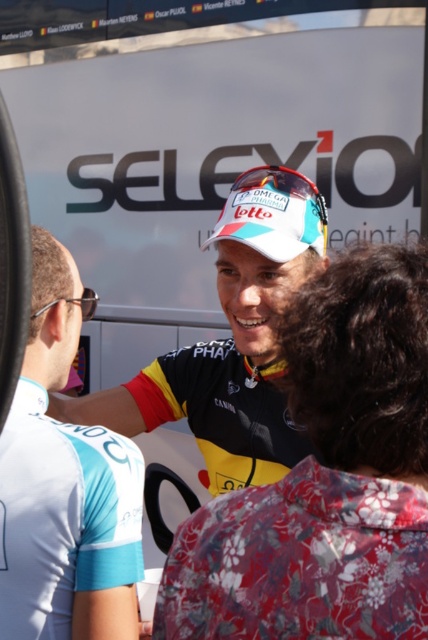
Looking at this image, can you confirm if teal jersey at center is positioned below clear plastic glasses at left?

Yes.

Image resolution: width=428 pixels, height=640 pixels. I want to click on teal jersey at center, so click(64, 488).

Which is above, black jersey at center or yellow and black jersey at center?

yellow and black jersey at center

Does black jersey at center have a larger size compared to yellow and black jersey at center?

No.

Find the location of `black jersey at center`. black jersey at center is located at coordinates (326, 477).

What do you see at coordinates (231, 340) in the screenshot? This screenshot has height=640, width=428. I see `yellow and black jersey at center` at bounding box center [231, 340].

This screenshot has height=640, width=428. Find the location of `yellow and black jersey at center`. yellow and black jersey at center is located at coordinates [231, 340].